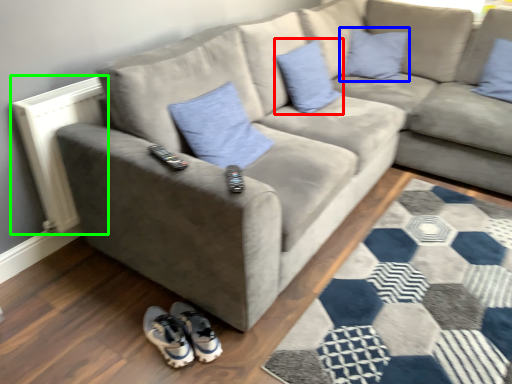
Question: Estimate the real-world distances between objects in this image. Which object is farther from pillow (highlighted by a red box), pillow (highlighted by a blue box) or radiator (highlighted by a green box)?

Choices:
 (A) pillow
 (B) radiator

Answer: (B)